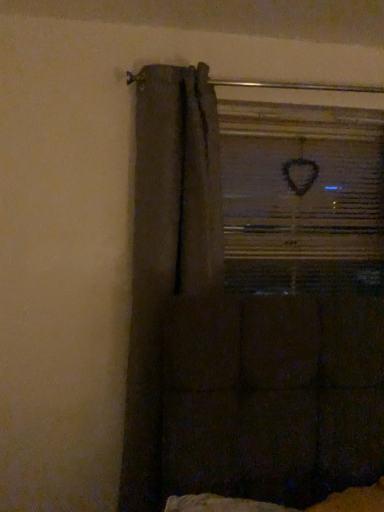
Question: From the image's perspective, is dark fabric curtain at left positioned above or below clear glass window at upper center?

Choices:
 (A) above
 (B) below

Answer: (B)

Question: Is dark fabric curtain at left taller or shorter than clear glass window at upper center?

Choices:
 (A) short
 (B) tall

Answer: (B)

Question: Relative to clear glass window at upper center, is dark fabric curtain at left in front or behind?

Choices:
 (A) behind
 (B) front

Answer: (B)

Question: From a real-world perspective, is clear glass window at upper center positioned above or below dark fabric curtain at left?

Choices:
 (A) above
 (B) below

Answer: (A)

Question: Considering the positions of clear glass window at upper center and dark fabric curtain at left in the image, is clear glass window at upper center bigger or smaller than dark fabric curtain at left?

Choices:
 (A) small
 (B) big

Answer: (A)

Question: Is clear glass window at upper center taller or shorter than dark fabric curtain at left?

Choices:
 (A) short
 (B) tall

Answer: (A)

Question: Would you say clear glass window at upper center is to the left or to the right of dark fabric curtain at left in the picture?

Choices:
 (A) right
 (B) left

Answer: (A)